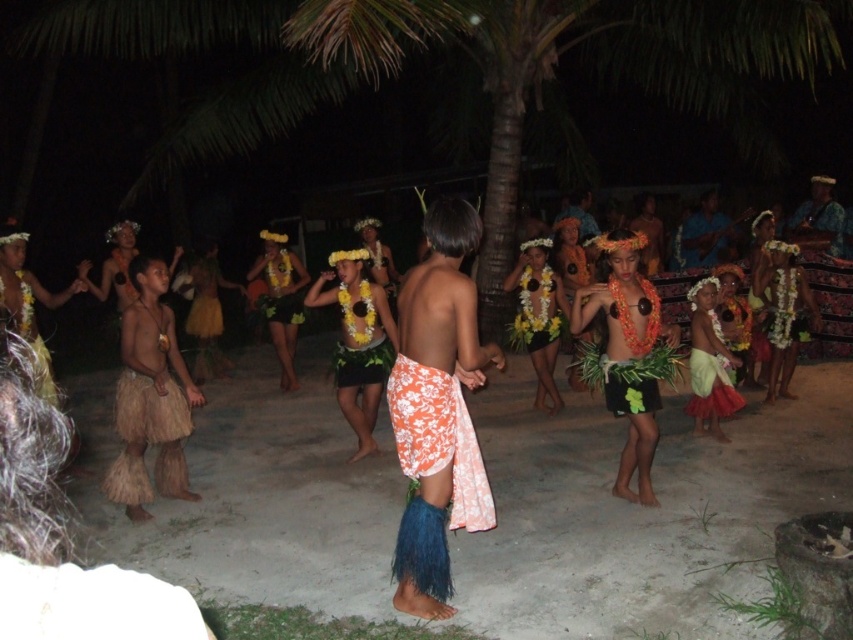
What do you see at coordinates (437, 410) in the screenshot?
I see `floral fabric skirt at center` at bounding box center [437, 410].

Can you confirm if floral fabric skirt at center is positioned to the right of blue fabric guitar at center?

In fact, floral fabric skirt at center is to the left of blue fabric guitar at center.

The height and width of the screenshot is (640, 853). What do you see at coordinates (437, 410) in the screenshot?
I see `floral fabric skirt at center` at bounding box center [437, 410].

Locate an element on the screen. Image resolution: width=853 pixels, height=640 pixels. floral fabric skirt at center is located at coordinates point(437,410).